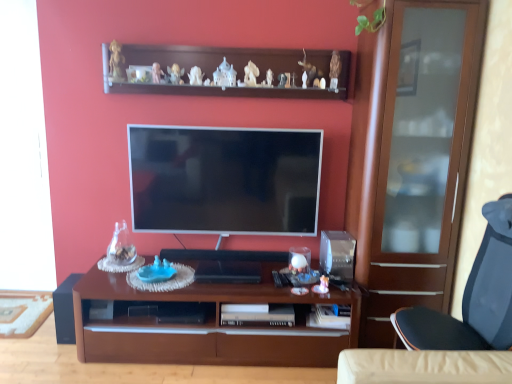
I want to click on free space in front of black matte speaker at lower left, so click(46, 354).